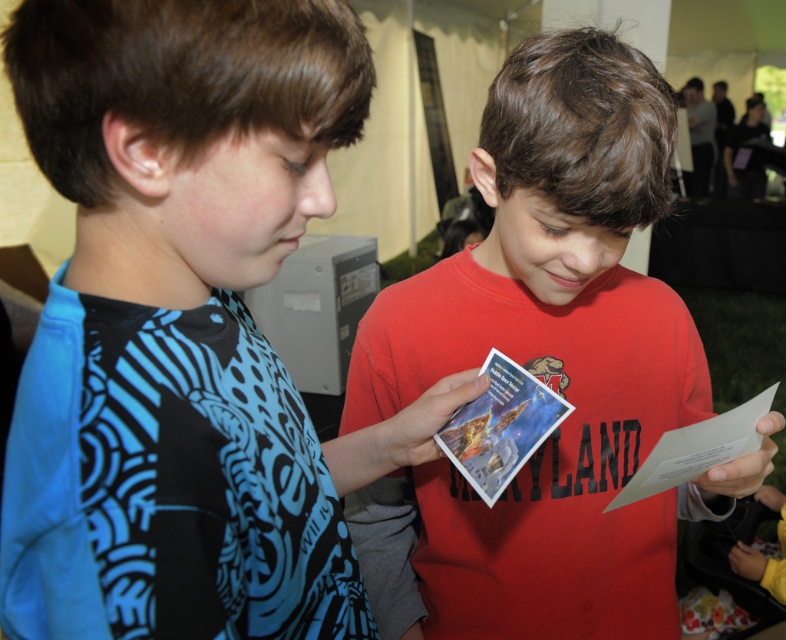
Question: Which object is positioned farthest from the blue printed shirt at left?

Choices:
 (A) white paper at center
 (B) metallic glossy card at center
 (C) red matte shirt at center

Answer: (A)

Question: Does red matte shirt at center lie in front of white paper at center?

Choices:
 (A) no
 (B) yes

Answer: (B)

Question: Can you confirm if red matte shirt at center is positioned above metallic glossy card at center?

Choices:
 (A) no
 (B) yes

Answer: (B)

Question: Is blue printed shirt at left further to camera compared to red matte shirt at center?

Choices:
 (A) no
 (B) yes

Answer: (A)

Question: Which is farther from the metallic glossy card at center?

Choices:
 (A) white paper at center
 (B) red matte shirt at center

Answer: (B)

Question: Which point is closer to the camera?

Choices:
 (A) white paper at center
 (B) blue printed shirt at left

Answer: (B)